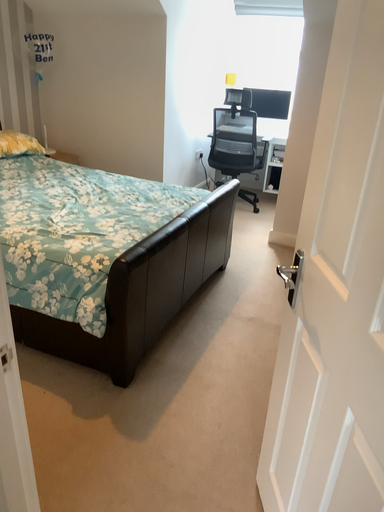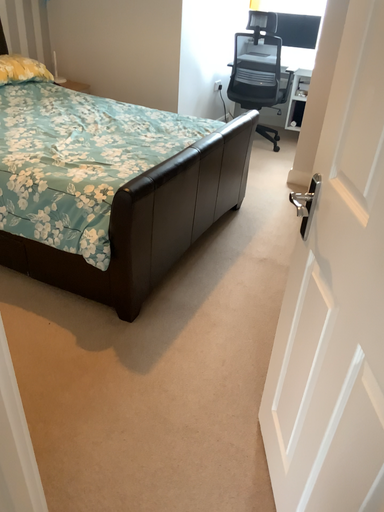
Question: Which way did the camera rotate in the video?

Choices:
 (A) rotated downward
 (B) rotated upward

Answer: (A)